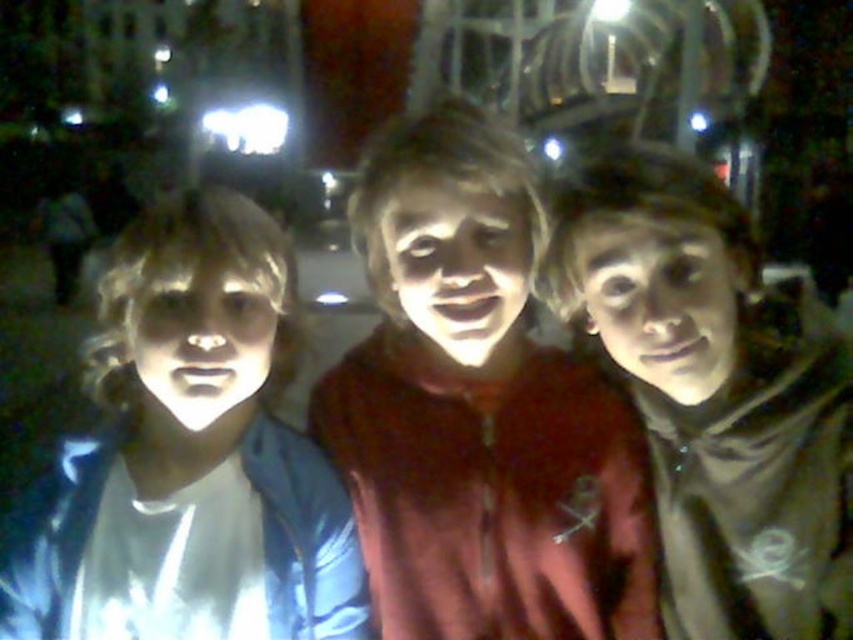
Question: Which object is farther from the camera taking this photo?

Choices:
 (A) matte blue jacket at left
 (B) matte black hoodie at center

Answer: (B)

Question: Observing the image, what is the correct spatial positioning of matte blue jacket at left in reference to matte black hoodie at center?

Choices:
 (A) left
 (B) right

Answer: (A)

Question: Estimate the real-world distances between objects in this image. Which object is farther from the matte red hoodie at center?

Choices:
 (A) matte blue jacket at left
 (B) matte black hoodie at center

Answer: (A)

Question: Does matte red hoodie at center have a smaller size compared to matte black hoodie at center?

Choices:
 (A) yes
 (B) no

Answer: (B)

Question: Is matte red hoodie at center smaller than matte blue jacket at left?

Choices:
 (A) no
 (B) yes

Answer: (A)

Question: Considering the real-world distances, which object is closest to the matte black hoodie at center?

Choices:
 (A) matte red hoodie at center
 (B) matte blue jacket at left

Answer: (A)